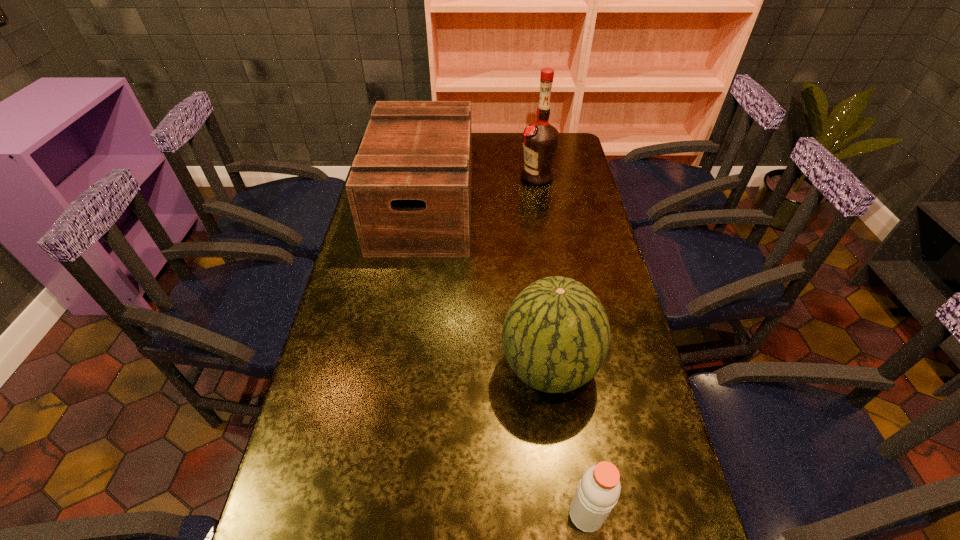
Where is `free space between the nearest object and the leftmost object`? The width and height of the screenshot is (960, 540). free space between the nearest object and the leftmost object is located at coordinates (505, 360).

Image resolution: width=960 pixels, height=540 pixels. Find the location of `free space between the second nearest object and the box`. free space between the second nearest object and the box is located at coordinates (486, 287).

Locate an element on the screen. the second closest object relative to the tallest object is located at coordinates (556, 334).

Identify which object is the nearest to the third farthest object. Please provide its 2D coordinates. Your answer should be formatted as a tuple, i.e. [(x, y)], where the tuple contains the x and y coordinates of a point satisfying the conditions above.

[(599, 489)]